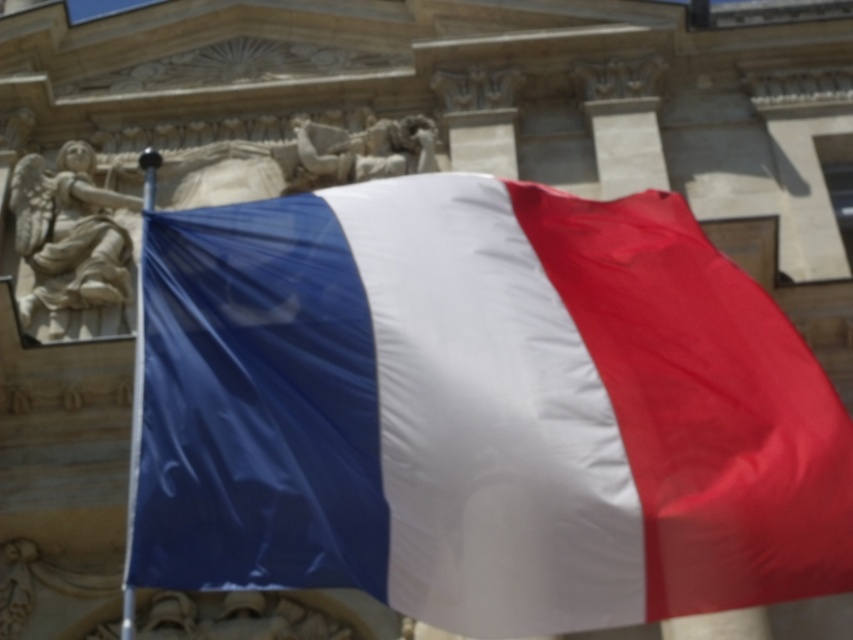
Question: Is silky fabric flag at center behind polished stone figures at center?

Choices:
 (A) yes
 (B) no

Answer: (B)

Question: Among these objects, which one is farthest from the camera?

Choices:
 (A) white stone angel at upper left
 (B) polished stone figures at center
 (C) silky fabric flag at center

Answer: (B)

Question: Observing the image, what is the correct spatial positioning of silky fabric flag at center in reference to polished stone figures at center?

Choices:
 (A) right
 (B) left

Answer: (A)

Question: Can you confirm if silky fabric flag at center is positioned to the right of white stone angel at upper left?

Choices:
 (A) yes
 (B) no

Answer: (A)

Question: Which object is positioned closest to the white stone angel at upper left?

Choices:
 (A) polished stone figures at center
 (B) silky fabric flag at center

Answer: (A)

Question: Estimate the real-world distances between objects in this image. Which object is farther from the white stone angel at upper left?

Choices:
 (A) silky fabric flag at center
 (B) polished stone figures at center

Answer: (A)